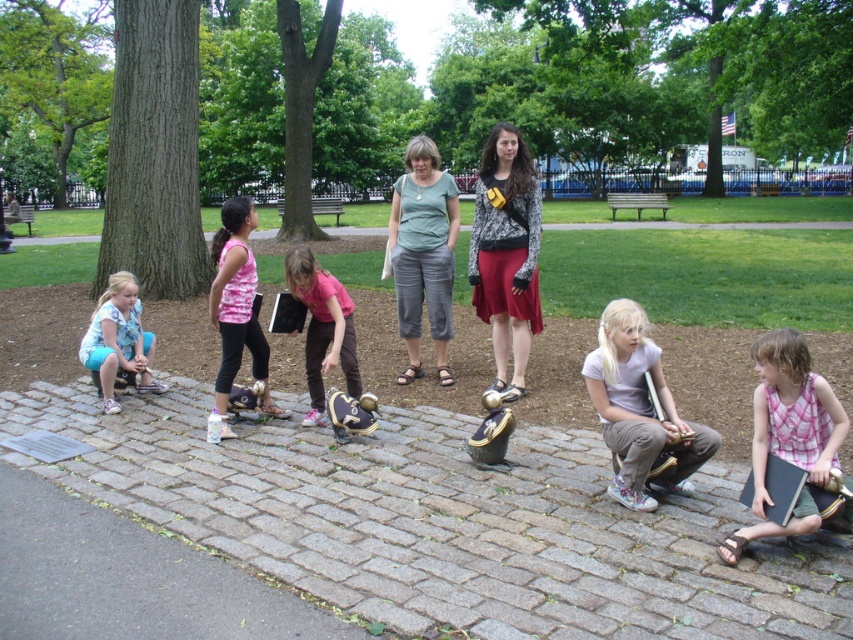
Is point (374, 611) positioned before point (804, 436)?

Yes, point (374, 611) is closer to viewer.

Who is more distant from viewer, (584, 536) or (822, 476)?

The point (584, 536) is behind.

Locate an element on the screen. This screenshot has height=640, width=853. gray cobblestone at center is located at coordinates (442, 522).

Measure the distance between point (637, 364) and camera.

Point (637, 364) and camera are 5.10 meters apart from each other.

The height and width of the screenshot is (640, 853). What do you see at coordinates (639, 408) in the screenshot?
I see `matte purple shirt at lower right` at bounding box center [639, 408].

This screenshot has width=853, height=640. In order to click on matte purple shirt at lower right in this screenshot , I will do `click(639, 408)`.

Locate an element on the screen. pink plaid shirt at lower right is located at coordinates (788, 435).

Can you confirm if pink plaid shirt at lower right is taller than pink fabric baseball glove at center?

In fact, pink plaid shirt at lower right may be shorter than pink fabric baseball glove at center.

Does point (752, 406) lie in front of point (349, 305)?

No, it is behind (349, 305).

What are the coordinates of `pink plaid shirt at lower right` in the screenshot? It's located at (788, 435).